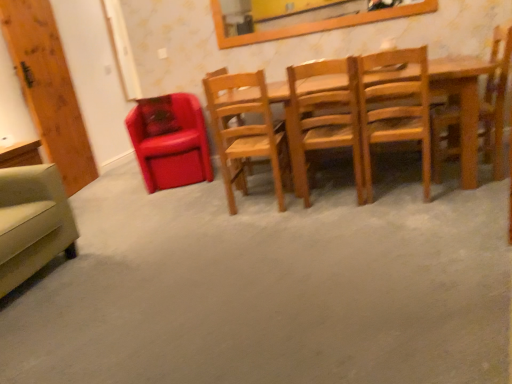
Where is `free space between beige fabric armchair at lower left, placed as the 6th chair when sorted from right to left, and wooden chair at center, arranged as the third chair when viewed from the left`? The width and height of the screenshot is (512, 384). free space between beige fabric armchair at lower left, placed as the 6th chair when sorted from right to left, and wooden chair at center, arranged as the third chair when viewed from the left is located at coordinates (140, 242).